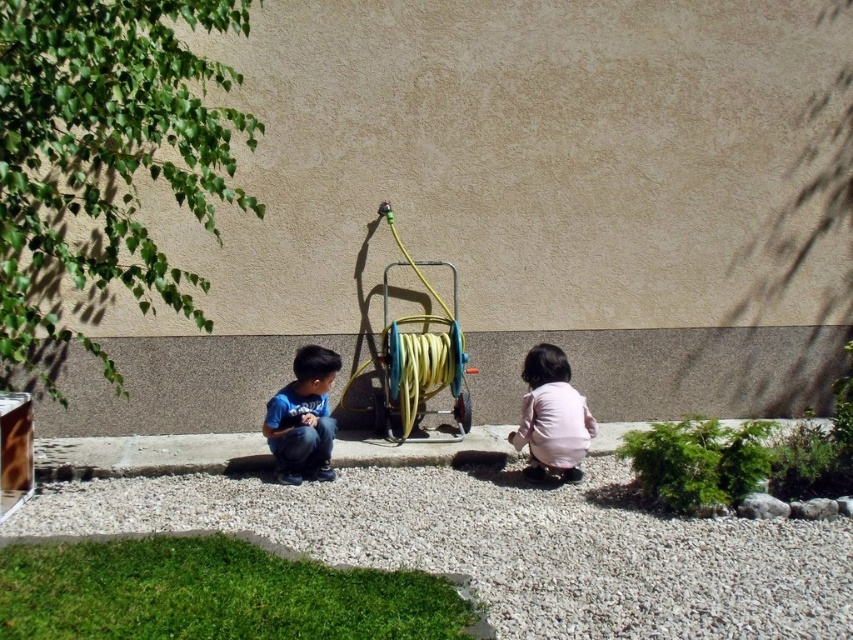
Who is taller, blue cotton shirt at lower center or white gravel at lower right?

With more height is blue cotton shirt at lower center.

I want to click on blue cotton shirt at lower center, so click(303, 417).

Identify the location of blue cotton shirt at lower center. (303, 417).

Locate an element on the screen. This screenshot has width=853, height=640. white gravel at lower center is located at coordinates (511, 545).

Is the position of white gravel at lower center less distant than that of blue cotton shirt at lower center?

Yes, it is.

Between point (670, 634) and point (297, 481), which one is positioned behind?

The point (297, 481) is behind.

Find the location of a particular element. The height and width of the screenshot is (640, 853). white gravel at lower center is located at coordinates (511, 545).

Does pink matte shirt at lower center appear on the left side of blue cotton shirt at lower center?

Incorrect, pink matte shirt at lower center is not on the left side of blue cotton shirt at lower center.

The width and height of the screenshot is (853, 640). What are the coordinates of `pink matte shirt at lower center` in the screenshot? It's located at (550, 417).